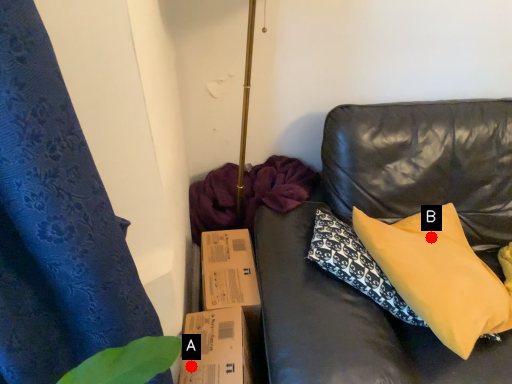
Question: Two points are circled on the image, labeled by A and B beside each circle. Which of the following is the closest to the observer?

Choices:
 (A) A is closer
 (B) B is closer

Answer: (A)